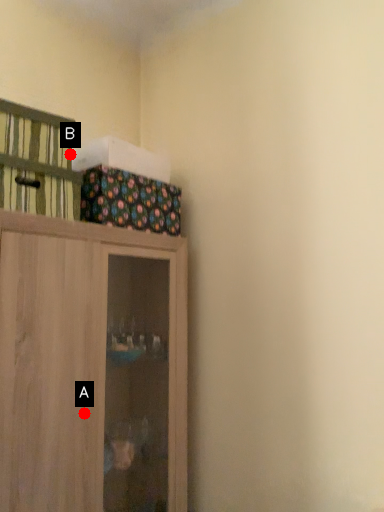
Question: Two points are circled on the image, labeled by A and B beside each circle. Which point is further to the camera?

Choices:
 (A) A is further
 (B) B is further

Answer: (B)